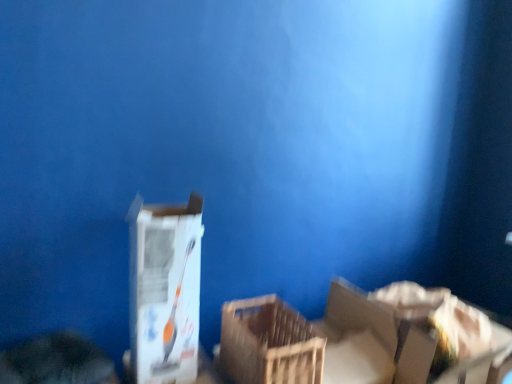
Describe the element at coordinates (269, 343) in the screenshot. I see `wooden crate at center` at that location.

You are a GUI agent. You are given a task and a screenshot of the screen. Output one action in this format:
    pyautogui.click(x=<x>, y=<y>)
    Task: Click on the wooden crate at center
    The height and width of the screenshot is (384, 512).
    Given the screenshot: What is the action you would take?
    pyautogui.click(x=269, y=343)

Image resolution: width=512 pixels, height=384 pixels. What do you see at coordinates (165, 290) in the screenshot?
I see `white cardboard box at center` at bounding box center [165, 290].

Locate an element on the screen. The width and height of the screenshot is (512, 384). white cardboard box at center is located at coordinates (165, 290).

This screenshot has height=384, width=512. In order to click on wooden crate at center in this screenshot , I will do `click(269, 343)`.

Where is `box in front of the wooden crate at center`? This screenshot has width=512, height=384. box in front of the wooden crate at center is located at coordinates (165, 290).

Considering the sizes of objects wooden crate at center and white cardboard box at center in the image provided, who is shorter, wooden crate at center or white cardboard box at center?

With less height is wooden crate at center.

Can you confirm if wooden crate at center is positioned to the right of white cardboard box at center?

Correct, you'll find wooden crate at center to the right of white cardboard box at center.

In terms of size, does wooden crate at center appear bigger or smaller than white cardboard box at center?

Clearly, wooden crate at center is smaller in size than white cardboard box at center.

Is point (238, 361) closer to viewer compared to point (227, 366)?

That is True.

In the scene shown: Is wooden crate at center located within white cardboard box at lower right?

No, wooden crate at center is not inside white cardboard box at lower right.

Is white cardboard box at lower right taller than wooden crate at center?

Yes, white cardboard box at lower right is taller than wooden crate at center.

How distant is white cardboard box at lower right from wooden crate at center?

white cardboard box at lower right is 4.87 inches from wooden crate at center.

Based on the photo, from the image's perspective, is wooden crate at center over white cardboard box at lower right?

Yes, from the image's perspective, wooden crate at center is over white cardboard box at lower right.

From a real-world perspective, which object stands above the other?

From a 3D spatial view, wooden crate at center is above.

Between point (222, 328) and point (253, 315), which one is positioned behind?

The point (253, 315) is farther from the camera.

Considering the relative sizes of white cardboard box at center and white cardboard box at lower right in the image provided, is white cardboard box at center taller than white cardboard box at lower right?

Yes, white cardboard box at center is taller than white cardboard box at lower right.

Is white cardboard box at center facing away from white cardboard box at lower right?

No, white cardboard box at center is not facing the opposite direction of white cardboard box at lower right.

How much distance is there between white cardboard box at center and white cardboard box at lower right?

white cardboard box at center and white cardboard box at lower right are 18.23 inches apart from each other.

Are white cardboard box at center and white cardboard box at lower right making contact?

There is a gap between white cardboard box at center and white cardboard box at lower right.

In order to click on box in front of the wooden crate at center in this screenshot , I will do `click(165, 290)`.

Choose the correct answer: Is white cardboard box at center inside wooden crate at center or outside it?

white cardboard box at center lies outside wooden crate at center.

Is the position of white cardboard box at center less distant than that of wooden crate at center?

Yes, the depth of white cardboard box at center is less than that of wooden crate at center.

The image size is (512, 384). Identify the location of storage box behind the white cardboard box at center. (337, 344).

Considering the sizes of objects white cardboard box at lower right and white cardboard box at center in the image provided, who is wider, white cardboard box at lower right or white cardboard box at center?

With larger width is white cardboard box at lower right.

Can you tell me how much white cardboard box at lower right and white cardboard box at center differ in facing direction?

The angle between the facing direction of white cardboard box at lower right and the facing direction of white cardboard box at center is 0.000855 degrees.

Is white cardboard box at lower right far away from white cardboard box at center?

No, white cardboard box at lower right is in close proximity to white cardboard box at center.

What are the coordinates of `crate that is below the white cardboard box at center (from the image's perspective)` in the screenshot? It's located at (269, 343).

Locate an element on the screen. crate above the white cardboard box at lower right (from a real-world perspective) is located at coordinates (269, 343).

Estimate the real-world distances between objects in this image. Which object is further from white cardboard box at center, wooden crate at center or white cardboard box at lower right?

Among the two, white cardboard box at lower right is located further to white cardboard box at center.

Consider the image. Estimate the real-world distances between objects in this image. Which object is further from wooden crate at center, white cardboard box at lower right or white cardboard box at center?

white cardboard box at center is further to wooden crate at center.

Estimate the real-world distances between objects in this image. Which object is closer to white cardboard box at lower right, wooden crate at center or white cardboard box at center?

wooden crate at center.

When comparing their distances from wooden crate at center, does white cardboard box at center or white cardboard box at lower right seem closer?

white cardboard box at lower right is closer to wooden crate at center.

Based on their spatial positions, is white cardboard box at lower right or wooden crate at center further from white cardboard box at center?

white cardboard box at lower right lies further to white cardboard box at center than the other object.

When comparing their distances from white cardboard box at lower right, does white cardboard box at center or wooden crate at center seem further?

Based on the image, white cardboard box at center appears to be further to white cardboard box at lower right.

In order to click on crate located between white cardboard box at center and white cardboard box at lower right in the left-right direction in this screenshot , I will do `click(269, 343)`.